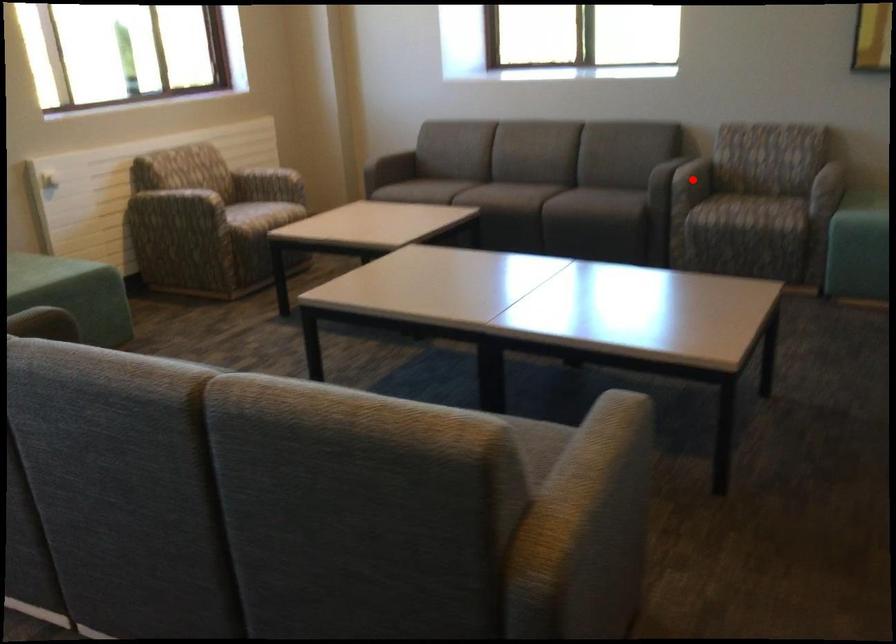
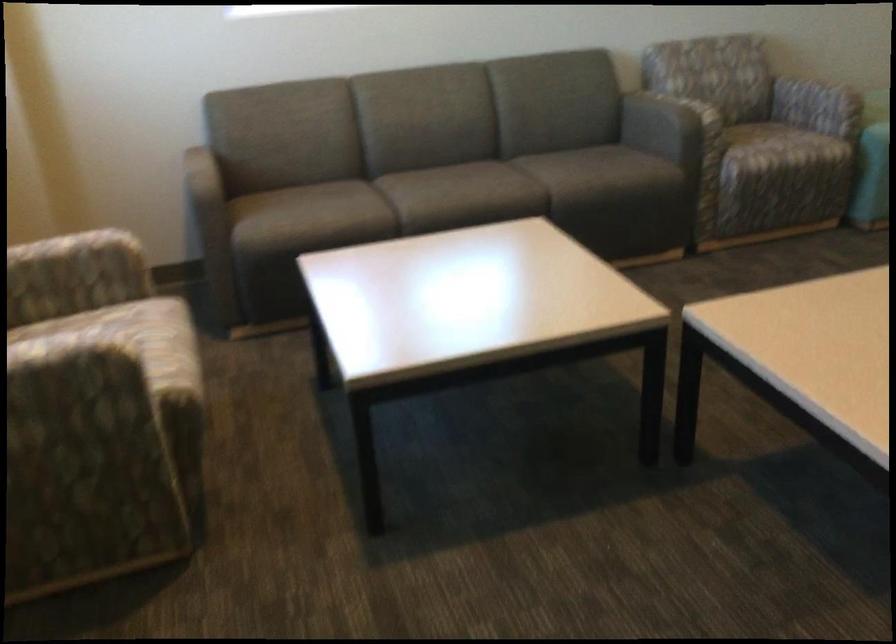
Question: I am providing you with two images of the same scene from different viewpoints. A red point is marked on the first image. Is the red point's position out of view in image 2?

Choices:
 (A) Yes
 (B) No

Answer: (A)